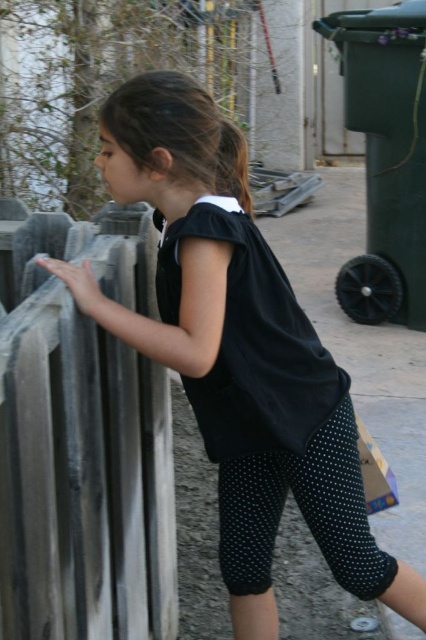
Question: Which of the following is the closest to the observer?

Choices:
 (A) rusty metal fence at left
 (B) black matte dress at center

Answer: (A)

Question: Which point is closer to the camera?

Choices:
 (A) rusty metal fence at left
 (B) black matte dress at center

Answer: (A)

Question: From the image, what is the correct spatial relationship of rusty metal fence at left in relation to black matte dress at center?

Choices:
 (A) above
 (B) below

Answer: (B)

Question: Does rusty metal fence at left lie in front of black matte dress at center?

Choices:
 (A) no
 (B) yes

Answer: (B)

Question: Is rusty metal fence at left to the right of black matte dress at center from the viewer's perspective?

Choices:
 (A) yes
 (B) no

Answer: (B)